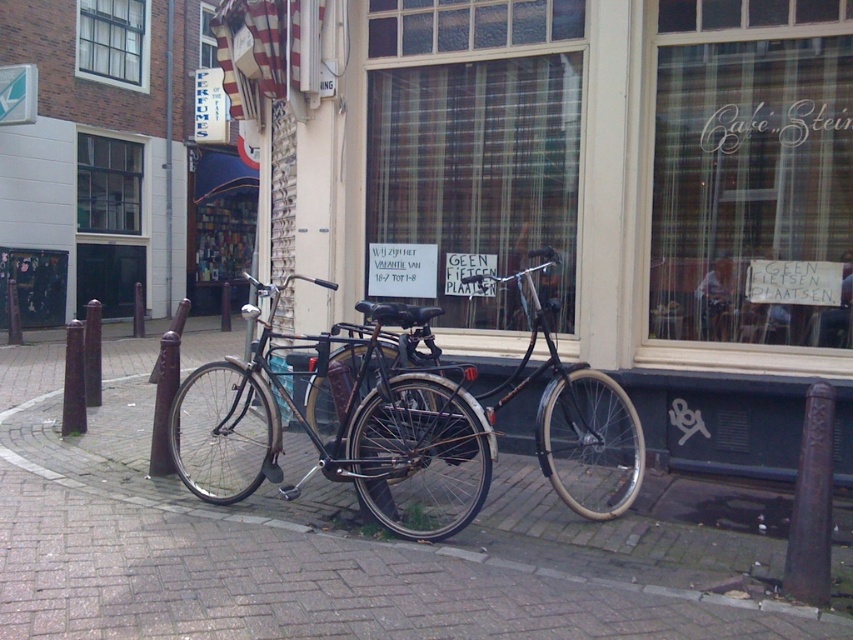
Question: Which object is the closest to the brick pavement at center?

Choices:
 (A) shiny black bicycle at center
 (B) shiny metallic bicycle at center

Answer: (A)

Question: Estimate the real-world distances between objects in this image. Which object is farther from the shiny metallic bicycle at center?

Choices:
 (A) plaid fabric shop window at center
 (B) shiny black bicycle at center
 (C) brick pavement at center
 (D) clear glass window at upper right

Answer: (D)

Question: Among these objects, which one is nearest to the camera?

Choices:
 (A) shiny metallic bicycle at center
 (B) brick pavement at center
 (C) clear glass window at upper right
 (D) plaid fabric shop window at center

Answer: (B)

Question: Can you confirm if clear glass window at upper right is positioned above shiny black bicycle at center?

Choices:
 (A) no
 (B) yes

Answer: (B)

Question: Is brick pavement at center above plaid fabric shop window at center?

Choices:
 (A) yes
 (B) no

Answer: (B)

Question: Can you confirm if clear glass window at upper right is bigger than plaid fabric shop window at center?

Choices:
 (A) no
 (B) yes

Answer: (A)